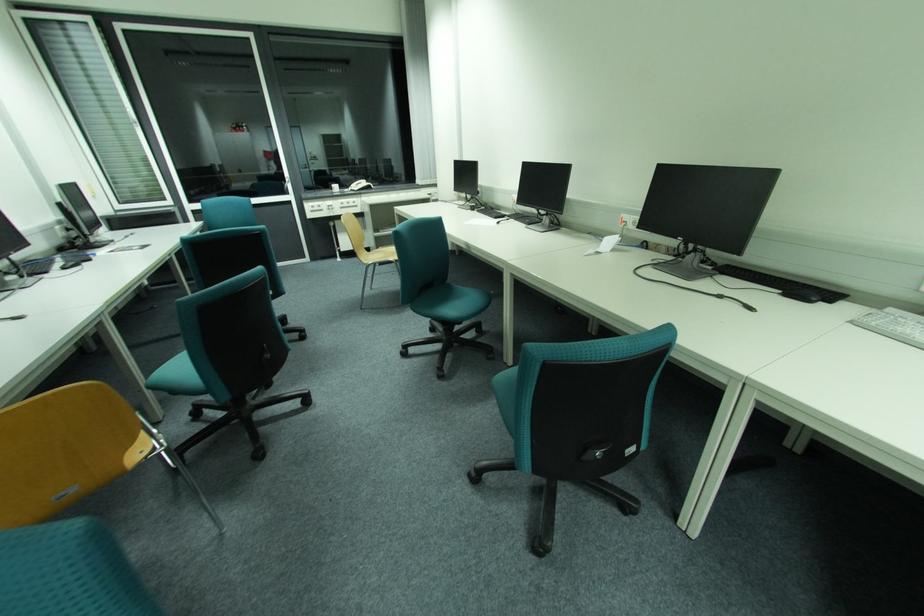
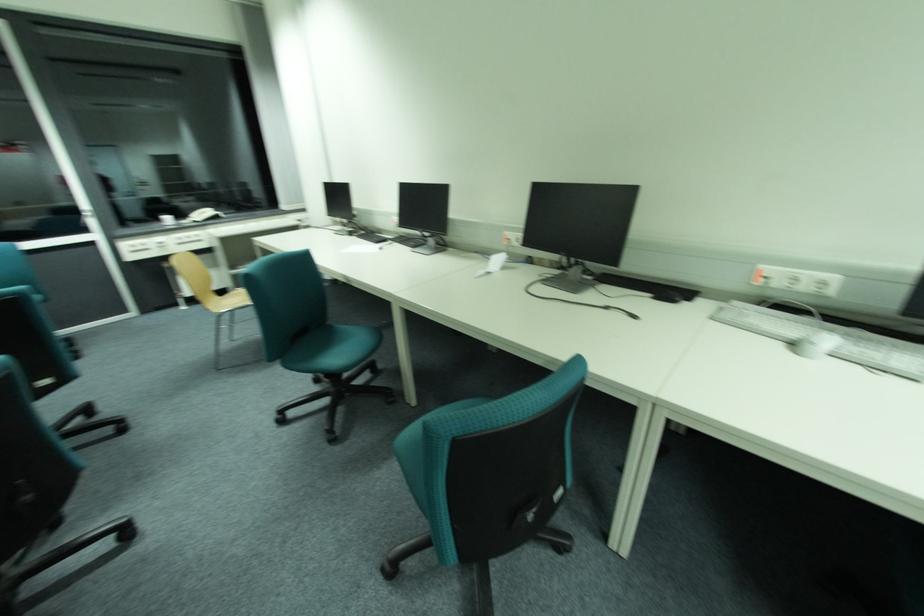
Locate, in the second image, the point that corresponds to [813,302] in the first image.

(678, 302)